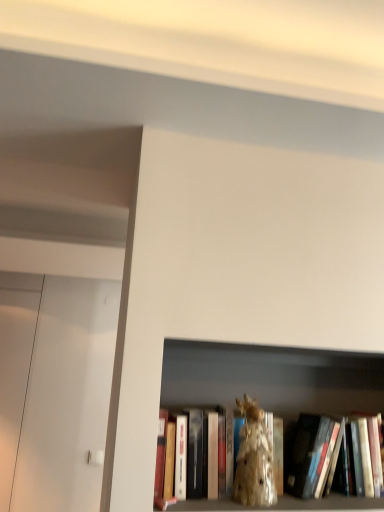
Question: Looking at the image, does shiny gold statue at center seem bigger or smaller compared to gold metallic statue at center?

Choices:
 (A) small
 (B) big

Answer: (A)

Question: Is shiny gold statue at center inside or outside of gold metallic statue at center?

Choices:
 (A) outside
 (B) inside

Answer: (B)

Question: Visually, is shiny gold statue at center positioned to the left or to the right of gold metallic statue at center?

Choices:
 (A) left
 (B) right

Answer: (A)

Question: From a real-world perspective, is gold metallic statue at center physically located above or below shiny gold statue at center?

Choices:
 (A) above
 (B) below

Answer: (A)

Question: Does point (292, 501) appear closer or farther from the camera than point (243, 440)?

Choices:
 (A) farther
 (B) closer

Answer: (B)

Question: From the image's perspective, is gold metallic statue at center positioned above or below shiny gold statue at center?

Choices:
 (A) above
 (B) below

Answer: (B)

Question: Is gold metallic statue at center spatially inside shiny gold statue at center, or outside of it?

Choices:
 (A) outside
 (B) inside

Answer: (A)